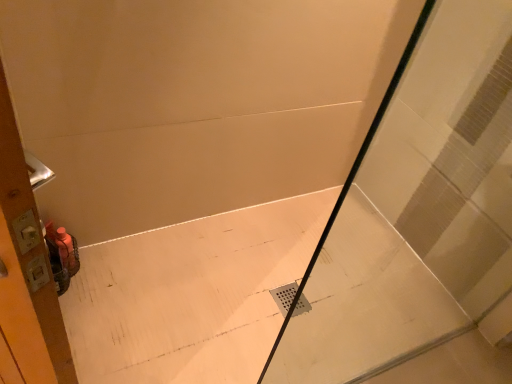
What is the approximate height of transparent glass door at center?

The height of transparent glass door at center is 1.22 meters.

Describe the element at coordinates (418, 215) in the screenshot. I see `transparent glass door at center` at that location.

Where is `transparent glass door at center`? transparent glass door at center is located at coordinates (418, 215).

Measure the distance between point (450, 9) and camera.

Point (450, 9) is 4.87 feet from camera.

In order to face transparent glass door at center, should I rotate leftwards or rightwards?

To face it directly, rotate right by 25.548 degrees.

Identify the location of transparent glass door at center. Image resolution: width=512 pixels, height=384 pixels. (418, 215).